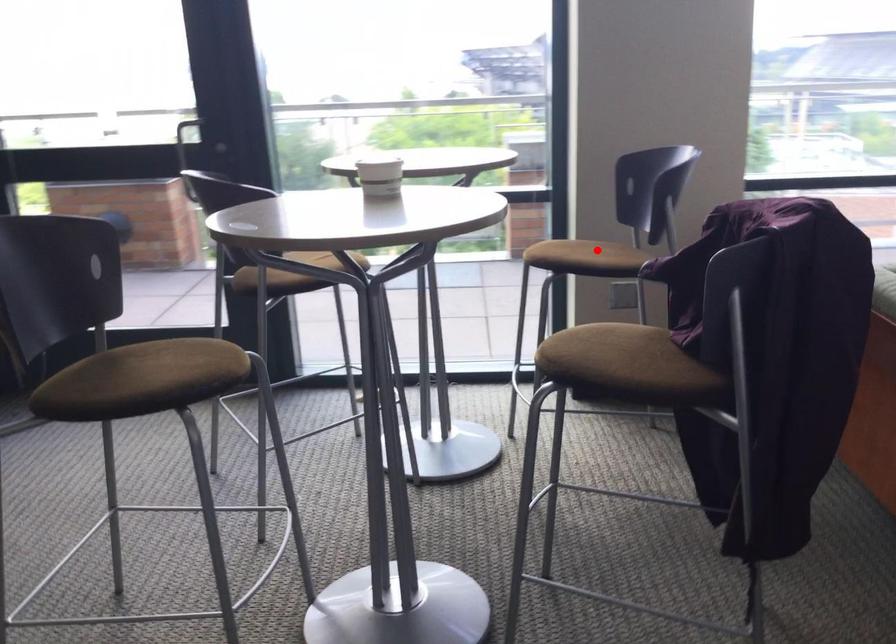
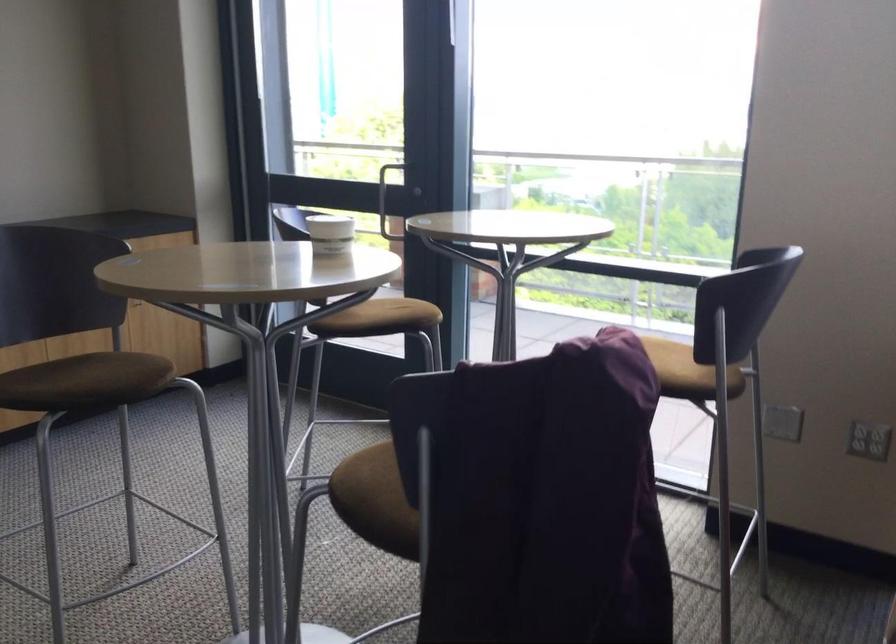
Question: I am providing you with two images of the same scene from different viewpoints. Given a red point in image1, look at the same physical point in image2. Is it:

Choices:
 (A) Closer to the viewpoint
 (B) Farther from the viewpoint

Answer: (A)